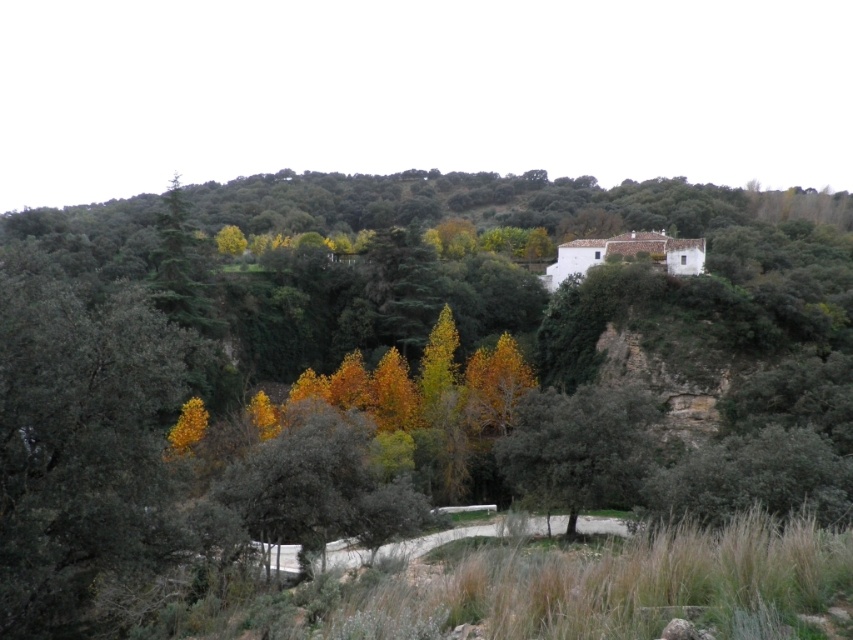
Question: Which point is closer to the camera?

Choices:
 (A) (x=106, y=512)
 (B) (x=561, y=440)
 (C) (x=339, y=289)

Answer: (A)

Question: Considering the relative positions of yellow-green leaves at upper center and yellow-green leafy tree at left in the image provided, where is yellow-green leaves at upper center located with respect to yellow-green leafy tree at left?

Choices:
 (A) left
 (B) right

Answer: (B)

Question: Which point is farther to the camera?

Choices:
 (A) (358, 461)
 (B) (100, 394)
 (C) (554, 508)

Answer: (C)

Question: Considering the real-world distances, which object is farthest from the green rough bark tree at center?

Choices:
 (A) yellow-green leaves at upper center
 (B) yellow-green leafy tree at left

Answer: (A)

Question: Is yellow-green leaves at upper center in front of yellow-green leafy tree at left?

Choices:
 (A) yes
 (B) no

Answer: (A)

Question: Is yellow-green leaves at upper center bigger than yellow-green leafy tree at left?

Choices:
 (A) yes
 (B) no

Answer: (A)